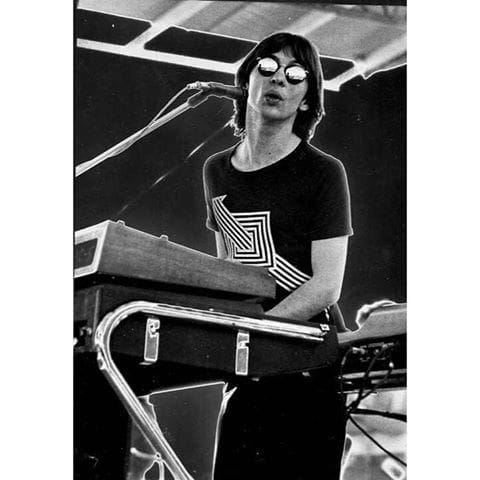
The image size is (480, 480). What are the coordinates of `cords` in the screenshot? It's located at coord(371,368).